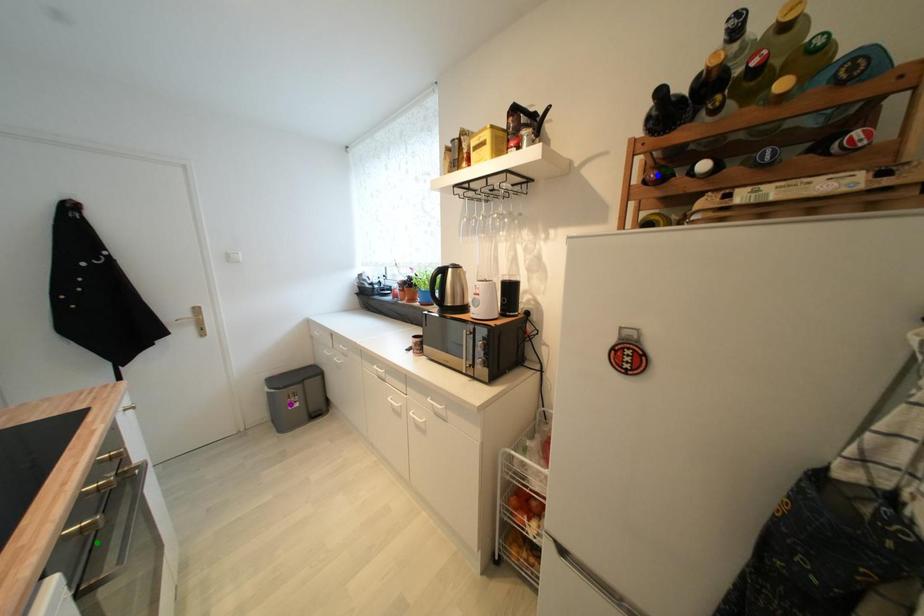
Order these from nearest to farthest:
blue point, purple point, green point

green point, blue point, purple point